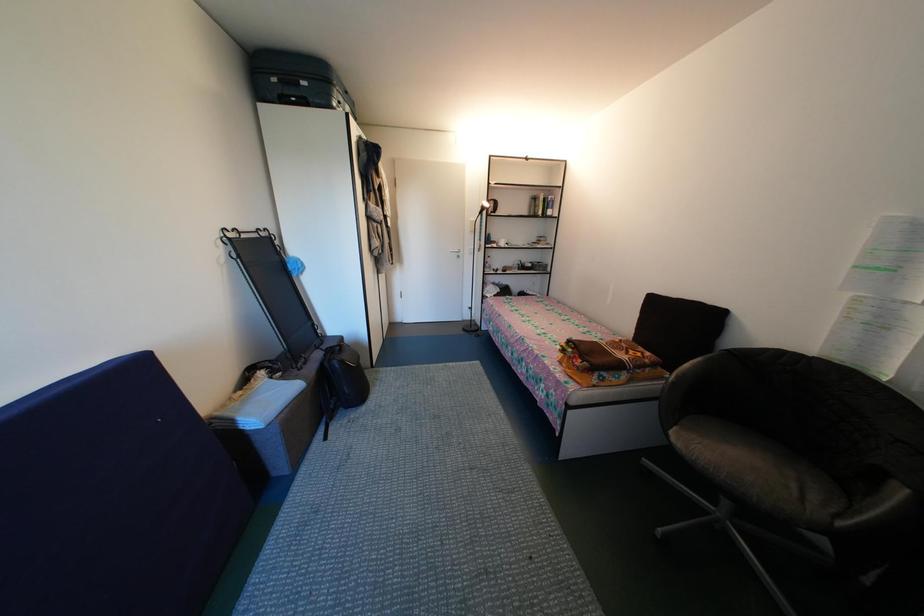
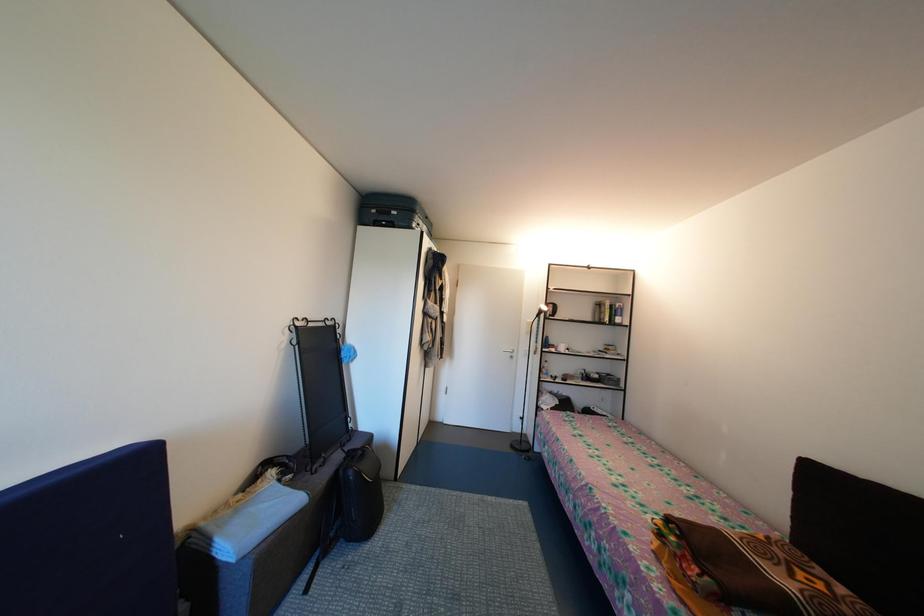
Question: In a continuous first-person perspective shot, in which direction is the camera moving?

Choices:
 (A) Left
 (B) Right
 (C) Forward
 (D) Backward

Answer: (C)